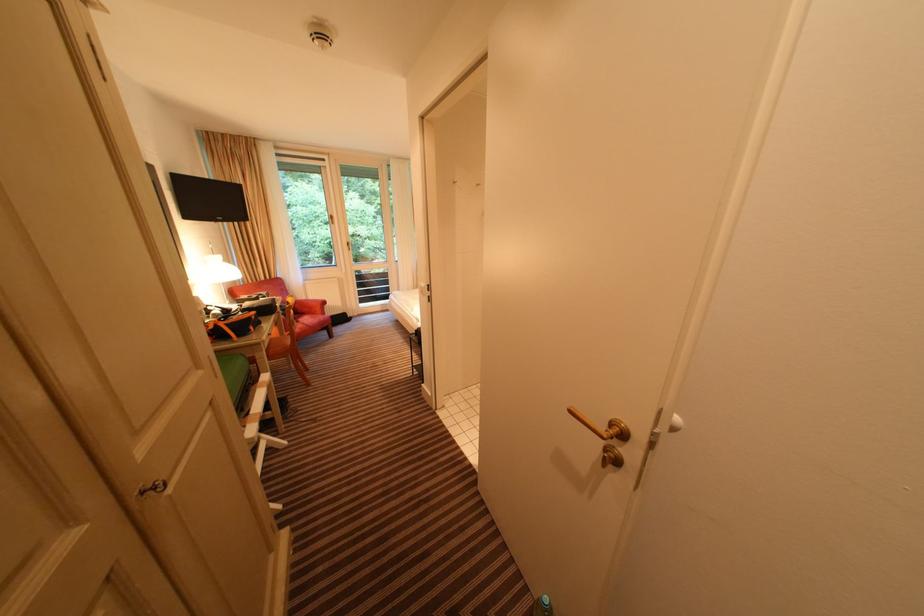
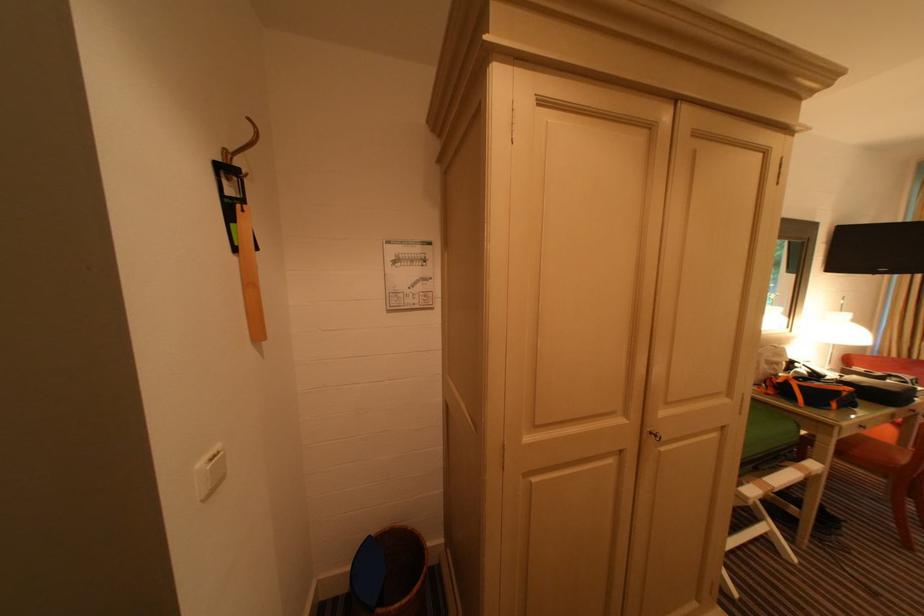
Question: The first image is from the beginning of the video and the second image is from the end. How did the camera likely rotate when shooting the video?

Choices:
 (A) Left
 (B) Right
 (C) Up
 (D) Down

Answer: (A)